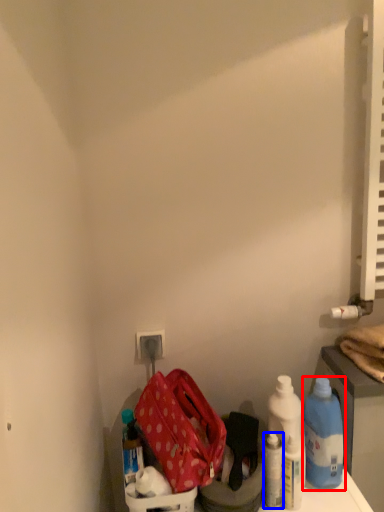
Question: Which point is further to the camera, bottle (highlighted by a red box) or bottle (highlighted by a blue box)?

Choices:
 (A) bottle
 (B) bottle

Answer: (A)